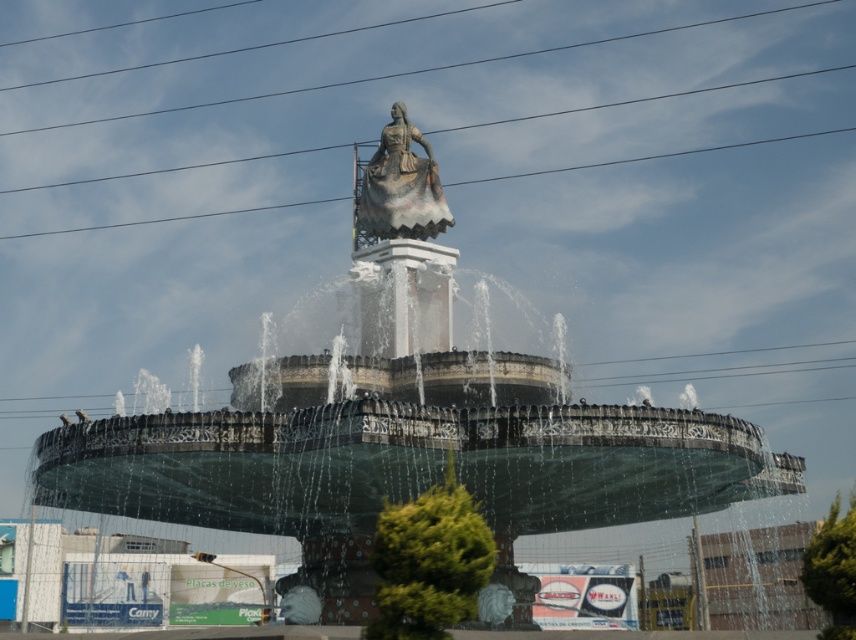
Does metallic wire at upper center have a smaller size compared to polished bronze statue at center?

Actually, metallic wire at upper center might be larger than polished bronze statue at center.

Is metallic wire at upper center positioned behind polished bronze statue at center?

Yes, it is behind polished bronze statue at center.

Describe the element at coordinates (417, 68) in the screenshot. I see `metallic wire at upper center` at that location.

Where is `metallic wire at upper center`? This screenshot has width=856, height=640. metallic wire at upper center is located at coordinates click(x=417, y=68).